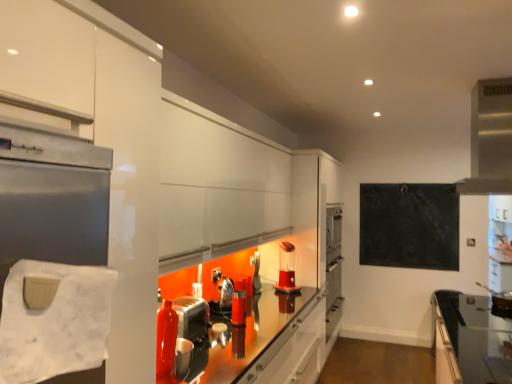
Question: Should I look upward or downward to see shiny metallic kettle at center, the 2th appliance viewed from the back?

Choices:
 (A) up
 (B) down

Answer: (B)

Question: Is black slate board at upper right closer to the viewer compared to shiny metallic kettle at center, the second appliance viewed from the front?

Choices:
 (A) yes
 (B) no

Answer: (B)

Question: Does black slate board at upper right have a larger size compared to shiny metallic kettle at center, the 2th appliance viewed from the back?

Choices:
 (A) yes
 (B) no

Answer: (A)

Question: Is black slate board at upper right thinner than shiny metallic kettle at center, the 2th appliance viewed from the back?

Choices:
 (A) yes
 (B) no

Answer: (A)

Question: Is shiny metallic kettle at center, the second appliance viewed from the front, inside black slate board at upper right?

Choices:
 (A) no
 (B) yes

Answer: (A)

Question: Does black slate board at upper right have a lesser height compared to shiny metallic kettle at center, the second appliance viewed from the front?

Choices:
 (A) yes
 (B) no

Answer: (B)

Question: From the image's perspective, is black slate board at upper right under shiny metallic kettle at center, the second appliance viewed from the front?

Choices:
 (A) yes
 (B) no

Answer: (B)

Question: Considering the relative sizes of black glass countertop at lower right and translucent plastic coffee machine at center in the image provided, is black glass countertop at lower right smaller than translucent plastic coffee machine at center?

Choices:
 (A) no
 (B) yes

Answer: (A)

Question: Can you confirm if black glass countertop at lower right is positioned to the left of translucent plastic coffee machine at center?

Choices:
 (A) no
 (B) yes

Answer: (A)

Question: Does black glass countertop at lower right have a greater height compared to translucent plastic coffee machine at center?

Choices:
 (A) yes
 (B) no

Answer: (A)

Question: Is black glass countertop at lower right next to translucent plastic coffee machine at center and touching it?

Choices:
 (A) yes
 (B) no

Answer: (B)

Question: From a real-world perspective, is black glass countertop at lower right positioned under translucent plastic coffee machine at center based on gravity?

Choices:
 (A) yes
 (B) no

Answer: (A)

Question: Can you confirm if black glass countertop at lower right is bigger than translucent plastic coffee machine at center?

Choices:
 (A) no
 (B) yes

Answer: (B)

Question: Does black glass countertop at lower right have a greater width compared to satin silver exhaust hood at upper right?

Choices:
 (A) yes
 (B) no

Answer: (A)